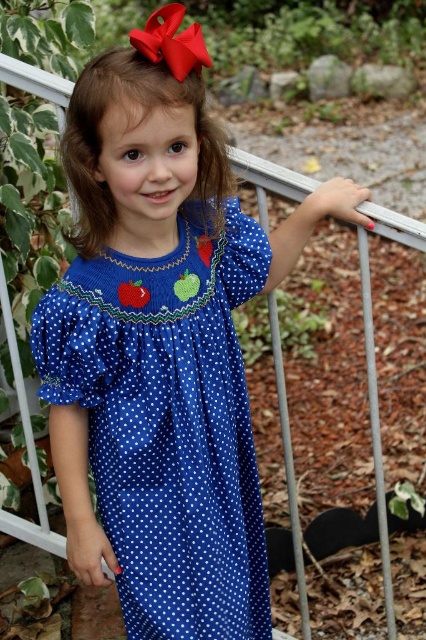
Question: Is brown silky hair at upper center above red satin bow at upper center?

Choices:
 (A) yes
 (B) no

Answer: (B)

Question: Which of the following is the farthest from the observer?

Choices:
 (A) (94, 93)
 (B) (239, 438)
 (C) (181, 36)

Answer: (B)

Question: Considering the relative positions of blue polka dot dress at center and brown silky hair at upper center in the image provided, where is blue polka dot dress at center located with respect to brown silky hair at upper center?

Choices:
 (A) below
 (B) above

Answer: (A)

Question: Is blue polka dot dress at center to the right of red satin bow at upper center from the viewer's perspective?

Choices:
 (A) yes
 (B) no

Answer: (A)

Question: Which point is farther to the camera?

Choices:
 (A) pyautogui.click(x=135, y=637)
 (B) pyautogui.click(x=83, y=86)
 (C) pyautogui.click(x=166, y=65)

Answer: (A)

Question: Considering the real-world distances, which object is closest to the red satin bow at upper center?

Choices:
 (A) brown silky hair at upper center
 (B) blue polka dot dress at center

Answer: (A)